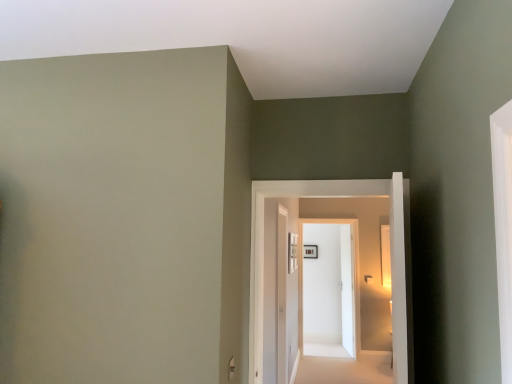
Question: Is white glossy door at center, the 2th door viewed from the left, to the right of wooden picture frame at center from the viewer's perspective?

Choices:
 (A) yes
 (B) no

Answer: (A)

Question: Is white glossy door at center, which appears as the 1th door when viewed from the back, located outside wooden picture frame at center?

Choices:
 (A) yes
 (B) no

Answer: (A)

Question: From the image's perspective, would you say white glossy door at center, the first door positioned from the right, is shown under wooden picture frame at center?

Choices:
 (A) no
 (B) yes

Answer: (B)

Question: Are white glossy door at center, the first door positioned from the right, and wooden picture frame at center beside each other?

Choices:
 (A) no
 (B) yes

Answer: (A)

Question: Is the depth of white glossy door at center, which is the second door from front to back, greater than that of wooden picture frame at center?

Choices:
 (A) no
 (B) yes

Answer: (A)

Question: Does point (309, 248) appear closer or farther from the camera than point (259, 238)?

Choices:
 (A) closer
 (B) farther

Answer: (B)

Question: Would you say wooden picture frame at center is to the left or to the right of white glossy door at center, the second door positioned from the right, in the picture?

Choices:
 (A) left
 (B) right

Answer: (B)

Question: Considering the positions of wooden picture frame at center and white glossy door at center, the second door positioned from the right, in the image, is wooden picture frame at center wider or thinner than white glossy door at center, the second door positioned from the right,?

Choices:
 (A) wide
 (B) thin

Answer: (B)

Question: From a real-world perspective, is wooden picture frame at center above or below white glossy door at center, which appears as the second door when viewed from the back?

Choices:
 (A) below
 (B) above

Answer: (B)

Question: Is white glossy door at center, the first door positioned from the right, in front of or behind wooden picture frame at center in the image?

Choices:
 (A) behind
 (B) front

Answer: (B)

Question: Considering the positions of white glossy door at center, which is the second door from front to back, and wooden picture frame at center in the image, is white glossy door at center, which is the second door from front to back, wider or thinner than wooden picture frame at center?

Choices:
 (A) wide
 (B) thin

Answer: (A)

Question: Based on their sizes in the image, would you say white glossy door at center, the first door positioned from the right, is bigger or smaller than wooden picture frame at center?

Choices:
 (A) big
 (B) small

Answer: (A)

Question: From the image's perspective, is white glossy door at center, which appears as the 1th door when viewed from the back, located above or below wooden picture frame at center?

Choices:
 (A) above
 (B) below

Answer: (B)

Question: Considering the positions of white carpet at center and wooden picture frame at center in the image, is white carpet at center bigger or smaller than wooden picture frame at center?

Choices:
 (A) big
 (B) small

Answer: (A)

Question: Considering the positions of white carpet at center and wooden picture frame at center in the image, is white carpet at center taller or shorter than wooden picture frame at center?

Choices:
 (A) short
 (B) tall

Answer: (A)